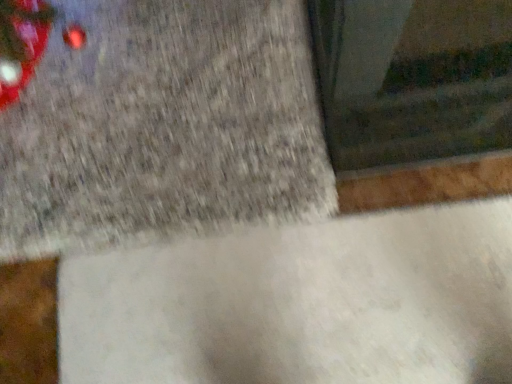
What do you see at coordinates (160, 124) in the screenshot? I see `gray concrete at upper left, the first concrete positioned from the top` at bounding box center [160, 124].

Where is `gray concrete at upper left, the first concrete positioned from the top`? This screenshot has width=512, height=384. gray concrete at upper left, the first concrete positioned from the top is located at coordinates pyautogui.click(x=160, y=124).

The width and height of the screenshot is (512, 384). Identify the location of white matte concrete at center, which is the first concrete from bottom to top. [300, 304].

Image resolution: width=512 pixels, height=384 pixels. What do you see at coordinates (300, 304) in the screenshot? I see `white matte concrete at center, which is the first concrete from bottom to top` at bounding box center [300, 304].

The image size is (512, 384). In order to click on gray concrete at upper left, the first concrete positioned from the top in this screenshot , I will do `click(160, 124)`.

Is gray concrete at upper left, the first concrete positioned from the top, at the right side of white matte concrete at center, which is the first concrete from bottom to top?

No, gray concrete at upper left, the first concrete positioned from the top, is not to the right of white matte concrete at center, which is the first concrete from bottom to top.

Which object is further away from the camera taking this photo, gray concrete at upper left, the second concrete ordered from the bottom, or white matte concrete at center, which is the first concrete from bottom to top?

Positioned behind is gray concrete at upper left, the second concrete ordered from the bottom.

Which is behind, point (30, 214) or point (114, 290)?

Point (30, 214)

From the image's perspective, is gray concrete at upper left, the second concrete ordered from the bottom, above or below white matte concrete at center, which is the first concrete from bottom to top?

From the image's perspective, gray concrete at upper left, the second concrete ordered from the bottom, appears above white matte concrete at center, which is the first concrete from bottom to top.

From a real-world perspective, is gray concrete at upper left, the second concrete ordered from the bottom, physically below white matte concrete at center, which is the first concrete from bottom to top?

No, from a real-world perspective, gray concrete at upper left, the second concrete ordered from the bottom, is not beneath white matte concrete at center, which is the first concrete from bottom to top.

Between gray concrete at upper left, the first concrete positioned from the top, and white matte concrete at center, which is the 2th concrete in top-to-bottom order, which one has larger width?

gray concrete at upper left, the first concrete positioned from the top, is wider.

Consider the image. In terms of height, does gray concrete at upper left, the second concrete ordered from the bottom, look taller or shorter compared to white matte concrete at center, which is the first concrete from bottom to top?

In the image, gray concrete at upper left, the second concrete ordered from the bottom, appears to be taller than white matte concrete at center, which is the first concrete from bottom to top.

Does gray concrete at upper left, the second concrete ordered from the bottom, have a smaller size compared to white matte concrete at center, which is the first concrete from bottom to top?

No.

Do you think gray concrete at upper left, the first concrete positioned from the top, is within white matte concrete at center, which is the first concrete from bottom to top, or outside of it?

gray concrete at upper left, the first concrete positioned from the top, is not enclosed by white matte concrete at center, which is the first concrete from bottom to top.

Is gray concrete at upper left, the first concrete positioned from the top, not close to white matte concrete at center, which is the 2th concrete in top-to-bottom order?

No, gray concrete at upper left, the first concrete positioned from the top, is in close proximity to white matte concrete at center, which is the 2th concrete in top-to-bottom order.

Is gray concrete at upper left, the first concrete positioned from the top, turned away from white matte concrete at center, which is the first concrete from bottom to top?

No, gray concrete at upper left, the first concrete positioned from the top,'s orientation is not away from white matte concrete at center, which is the first concrete from bottom to top.

This screenshot has width=512, height=384. There is a white matte concrete at center, which is the first concrete from bottom to top. What are the coordinates of `concrete above it (from a real-world perspective)` in the screenshot? It's located at (160, 124).

Which object is positioned more to the left, white matte concrete at center, which is the 2th concrete in top-to-bottom order, or gray concrete at upper left, the second concrete ordered from the bottom?

gray concrete at upper left, the second concrete ordered from the bottom, is more to the left.

In the image, is white matte concrete at center, which is the 2th concrete in top-to-bottom order, positioned in front of or behind gray concrete at upper left, the second concrete ordered from the bottom?

In the image, white matte concrete at center, which is the 2th concrete in top-to-bottom order, appears in front of gray concrete at upper left, the second concrete ordered from the bottom.

Is point (174, 306) behind point (95, 210)?

No, it is not.

From the image's perspective, is white matte concrete at center, which is the first concrete from bottom to top, under gray concrete at upper left, the first concrete positioned from the top?

Yes.

From a real-world perspective, is white matte concrete at center, which is the 2th concrete in top-to-bottom order, physically below gray concrete at upper left, the first concrete positioned from the top?

Yes, from a real-world perspective, white matte concrete at center, which is the 2th concrete in top-to-bottom order, is below gray concrete at upper left, the first concrete positioned from the top.

Which of these two, white matte concrete at center, which is the first concrete from bottom to top, or gray concrete at upper left, the second concrete ordered from the bottom, is thinner?

Thinner between the two is white matte concrete at center, which is the first concrete from bottom to top.

Which of these two, white matte concrete at center, which is the first concrete from bottom to top, or gray concrete at upper left, the first concrete positioned from the top, stands taller?

gray concrete at upper left, the first concrete positioned from the top.

Considering the relative sizes of white matte concrete at center, which is the 2th concrete in top-to-bottom order, and gray concrete at upper left, the first concrete positioned from the top, in the image provided, is white matte concrete at center, which is the 2th concrete in top-to-bottom order, bigger than gray concrete at upper left, the first concrete positioned from the top,?

No, white matte concrete at center, which is the 2th concrete in top-to-bottom order, is not bigger than gray concrete at upper left, the first concrete positioned from the top.

Is white matte concrete at center, which is the first concrete from bottom to top, situated inside gray concrete at upper left, the first concrete positioned from the top, or outside?

white matte concrete at center, which is the first concrete from bottom to top, exists outside the volume of gray concrete at upper left, the first concrete positioned from the top.

Is white matte concrete at center, which is the 2th concrete in top-to-bottom order, oriented towards gray concrete at upper left, the first concrete positioned from the top?

Yes.

The height and width of the screenshot is (384, 512). In order to click on concrete lying below the gray concrete at upper left, the first concrete positioned from the top (from the image's perspective) in this screenshot , I will do `click(300, 304)`.

I want to click on concrete above the white matte concrete at center, which is the 2th concrete in top-to-bottom order (from the image's perspective), so click(160, 124).

Where is `concrete to the left of white matte concrete at center, which is the first concrete from bottom to top`? This screenshot has height=384, width=512. concrete to the left of white matte concrete at center, which is the first concrete from bottom to top is located at coordinates (160, 124).